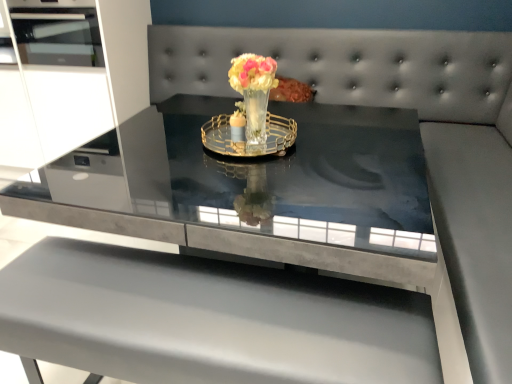
At what (x,y) coordinates should I click in order to perform the action: click on vacant area to the right of gold metallic tray at center. Please return your answer as a coordinate pair (x, y). The image size is (512, 384). Looking at the image, I should click on (343, 144).